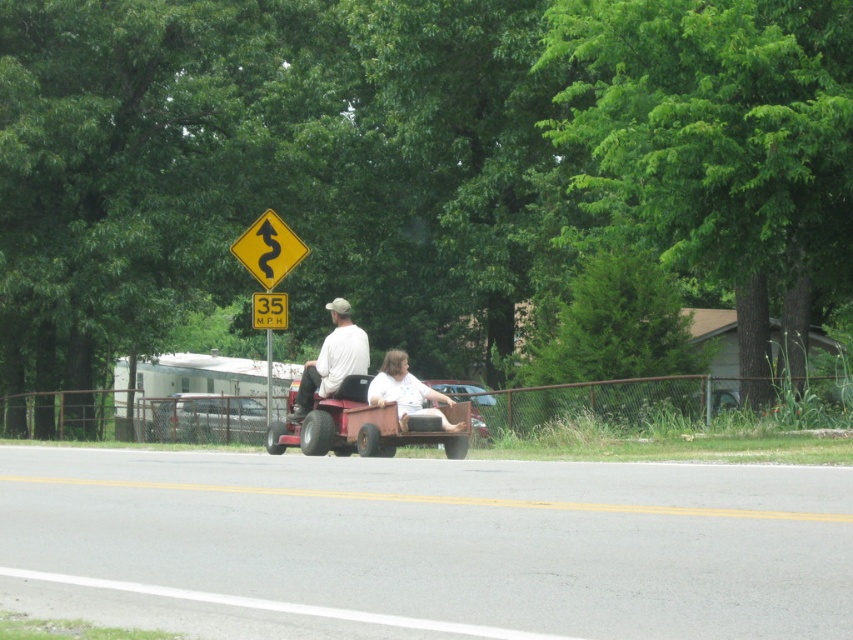
You are standing at the point marked as point (x=207, y=419). What object is exactly at this location?

The silver metallic car at center is located at point (x=207, y=419).

In the scene shown: You are standing at the camera position and want to reach the point marked at coordinates (399, 417). Considering the trailer is 10 feet long, can you safely drive the trailer from its current position to the point without hitting any obstacles?

The point at coordinates (399, 417) is 58.75 feet away from the camera. Since the trailer is only 10 feet long, there is sufficient space to safely drive it to the point without obstacles in the scene as described.